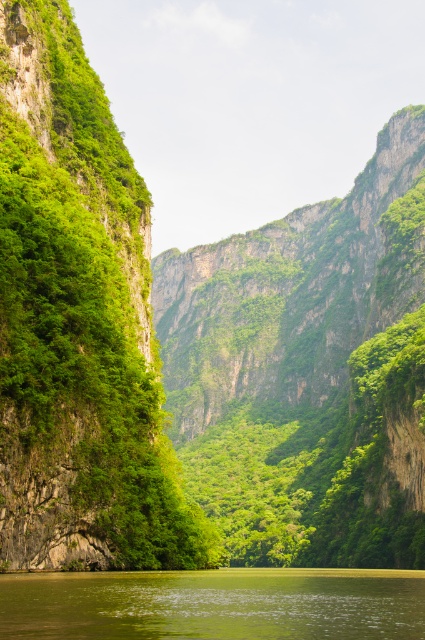
The image size is (425, 640). What do you see at coordinates (79, 324) in the screenshot?
I see `green leafy vegetation at left` at bounding box center [79, 324].

Does point (54, 376) come closer to viewer compared to point (325, 609)?

No, it is not.

Find the location of a particular element. The height and width of the screenshot is (640, 425). green leafy vegetation at left is located at coordinates (79, 324).